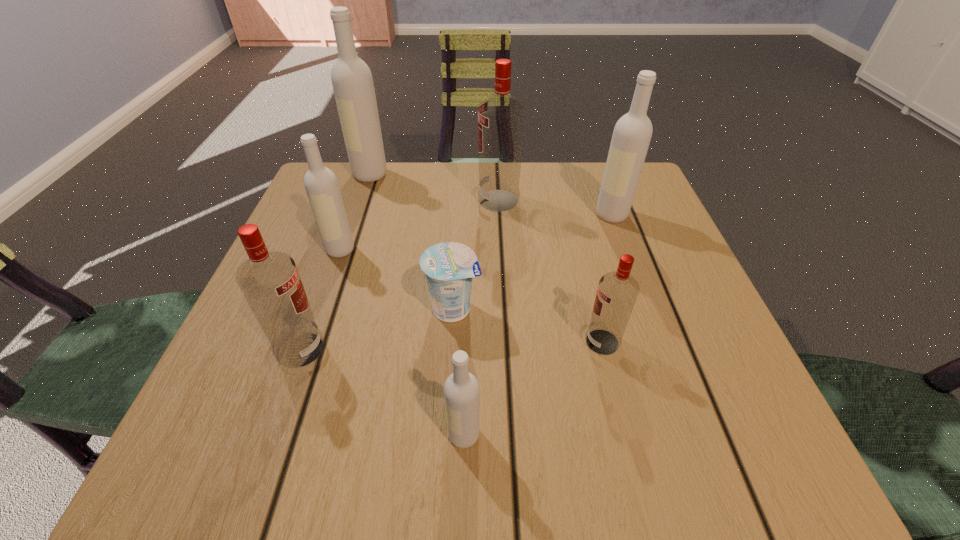
Locate an element on the screen. The width and height of the screenshot is (960, 540). vacant space situated on the front of the second smallest white vodka is located at coordinates (321, 305).

You are a GUI agent. You are given a task and a screenshot of the screen. Output one action in this format:
    pyautogui.click(x=<x>, y=<y>)
    Task: Click on the vacant space located on the front label of the second smallest red vodka
    
    Given the screenshot: What is the action you would take?
    pyautogui.click(x=564, y=349)

You are a GUI agent. You are given a task and a screenshot of the screen. Output one action in this format:
    pyautogui.click(x=<x>, y=<y>)
    Task: Click on the vacant space located on the front label of the smallest red vodka
    The image size is (960, 540).
    Given the screenshot: What is the action you would take?
    pyautogui.click(x=554, y=342)

What are the coordinates of `free location located on the front label of the smallest red vodka` in the screenshot? It's located at (373, 342).

The width and height of the screenshot is (960, 540). What are the coordinates of `free point located on the front label of the smallest red vodka` in the screenshot? It's located at (386, 342).

I want to click on free spot located on the left of the smallest white vodka, so pos(404,435).

You are a GUI agent. You are given a task and a screenshot of the screen. Output one action in this format:
    pyautogui.click(x=<x>, y=<y>)
    Task: Click on the vacant space situated on the front of the yogurt
    The width and height of the screenshot is (960, 540).
    Given the screenshot: What is the action you would take?
    pyautogui.click(x=448, y=394)

Image resolution: width=960 pixels, height=540 pixels. Find the location of `object present at the near edge`. object present at the near edge is located at coordinates (461, 389).

At what (x,y) coordinates should I click in order to perform the action: click on object at the right edge. Please return your answer as a coordinate pair (x, y). Looking at the image, I should click on (632, 133).

You are a GUI agent. You are given a task and a screenshot of the screen. Output one action in this format:
    pyautogui.click(x=<x>, y=<y>)
    Task: Click on the object that is at the far left corner
    The width and height of the screenshot is (960, 540).
    Given the screenshot: What is the action you would take?
    pyautogui.click(x=352, y=81)